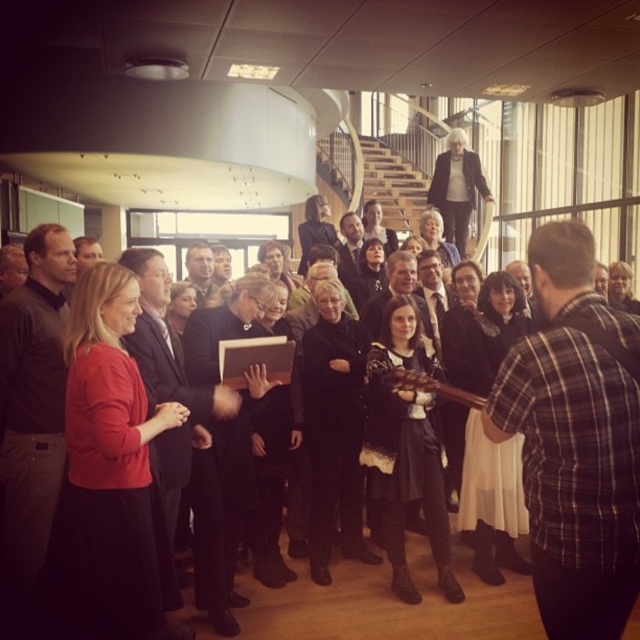
Question: Considering the real-world distances, which object is closest to the dark gray shirt at left?

Choices:
 (A) smooth black suit at center
 (B) dark suit at center
 (C) plaid cotton shirt at right
 (D) matte black suit at center

Answer: (D)

Question: From the image, what is the correct spatial relationship of dark gray shirt at left in relation to matte black suit at center?

Choices:
 (A) above
 (B) below

Answer: (A)

Question: Which object is positioned farthest from the matte black suit at center?

Choices:
 (A) matte brown jacket at center
 (B) smooth black suit at center
 (C) dark suit at center

Answer: (B)

Question: Is plaid cotton shirt at right positioned behind matte black suit at center?

Choices:
 (A) no
 (B) yes

Answer: (A)

Question: Which object appears closest to the camera in this image?

Choices:
 (A) matte black suit at center
 (B) dark suit at center
 (C) matte brown jacket at center
 (D) smooth black suit at center

Answer: (A)

Question: In this image, where is dark suit at center located relative to matte brown jacket at center?

Choices:
 (A) right
 (B) left

Answer: (A)